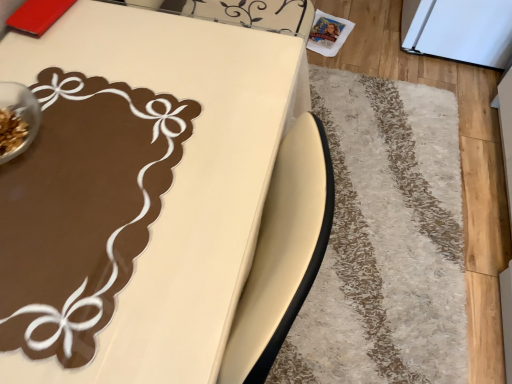
What do you see at coordinates (385, 241) in the screenshot?
I see `white shaggy rug at lower right` at bounding box center [385, 241].

This screenshot has width=512, height=384. I want to click on white shaggy rug at lower right, so click(385, 241).

Measure the distance between matte brown table at upper left and camera.

matte brown table at upper left is 19.29 inches from camera.

Image resolution: width=512 pixels, height=384 pixels. I want to click on matte brown table at upper left, so click(135, 193).

What do you see at coordinates (135, 193) in the screenshot?
I see `matte brown table at upper left` at bounding box center [135, 193].

In order to face matte brown table at upper left, should I rotate leftwards or rightwards?

You should rotate left by 13.070 degrees.

What are the coordinates of `white shaggy rug at lower right` in the screenshot? It's located at (385, 241).

Which is more to the left, matte brown table at upper left or white shaggy rug at lower right?

matte brown table at upper left is more to the left.

Which object is further away from the camera, matte brown table at upper left or white shaggy rug at lower right?

white shaggy rug at lower right is more distant.

Considering the positions of point (120, 199) and point (408, 152), is point (120, 199) closer or farther from the camera than point (408, 152)?

Point (120, 199).

From the image's perspective, is matte brown table at upper left located above white shaggy rug at lower right?

No.

From a real-world perspective, is matte brown table at upper left above or below white shaggy rug at lower right?

From a real-world perspective, matte brown table at upper left is physically above white shaggy rug at lower right.

Between matte brown table at upper left and white shaggy rug at lower right, which one has larger width?

white shaggy rug at lower right.

Considering the sizes of objects matte brown table at upper left and white shaggy rug at lower right in the image provided, who is taller, matte brown table at upper left or white shaggy rug at lower right?

With more height is matte brown table at upper left.

Considering the sizes of matte brown table at upper left and white shaggy rug at lower right in the image, is matte brown table at upper left bigger or smaller than white shaggy rug at lower right?

Clearly, matte brown table at upper left is larger in size than white shaggy rug at lower right.

Would you say matte brown table at upper left is inside or outside white shaggy rug at lower right?

The correct answer is: outside.

Is the surface of matte brown table at upper left in direct contact with white shaggy rug at lower right?

No.

Is matte brown table at upper left oriented towards white shaggy rug at lower right?

No, matte brown table at upper left is not oriented towards white shaggy rug at lower right.

Find the location of a particular element. mat above the matte brown table at upper left (from the image's perspective) is located at coordinates (385, 241).

Can you confirm if white shaggy rug at lower right is positioned to the right of matte brown table at upper left?

Correct, you'll find white shaggy rug at lower right to the right of matte brown table at upper left.

Considering the positions of objects white shaggy rug at lower right and matte brown table at upper left in the image provided, who is behind, white shaggy rug at lower right or matte brown table at upper left?

white shaggy rug at lower right is further away from the camera.

Which point is more distant from viewer, (397, 227) or (189, 201)?

The point (397, 227) is behind.

From the image's perspective, which is below, white shaggy rug at lower right or matte brown table at upper left?

matte brown table at upper left.

From a real-world perspective, between white shaggy rug at lower right and matte brown table at upper left, who is vertically higher?

matte brown table at upper left is physically above.

Which of these two, white shaggy rug at lower right or matte brown table at upper left, is thinner?

Thinner between the two is matte brown table at upper left.

Is white shaggy rug at lower right shorter than matte brown table at upper left?

Indeed, white shaggy rug at lower right has a lesser height compared to matte brown table at upper left.

Considering the sizes of white shaggy rug at lower right and matte brown table at upper left in the image, is white shaggy rug at lower right bigger or smaller than matte brown table at upper left?

Clearly, white shaggy rug at lower right is smaller in size than matte brown table at upper left.

Can we say white shaggy rug at lower right lies outside matte brown table at upper left?

Yes, white shaggy rug at lower right is located beyond the bounds of matte brown table at upper left.

Is white shaggy rug at lower right far away from matte brown table at upper left?

No, white shaggy rug at lower right is not far away from matte brown table at upper left.

Is white shaggy rug at lower right aimed at matte brown table at upper left?

No, white shaggy rug at lower right is not aimed at matte brown table at upper left.

How different are the orientations of white shaggy rug at lower right and matte brown table at upper left in degrees?

They differ by 1.2 degrees in their facing directions.

In the image, there is a white shaggy rug at lower right. Where is `table below it (from the image's perspective)`? The height and width of the screenshot is (384, 512). table below it (from the image's perspective) is located at coordinates (135, 193).

In the image, there is a matte brown table at upper left. Where is `mat above it (from the image's perspective)`? mat above it (from the image's perspective) is located at coordinates (385, 241).

Image resolution: width=512 pixels, height=384 pixels. What are the coordinates of `table on the left of white shaggy rug at lower right` in the screenshot? It's located at (135, 193).